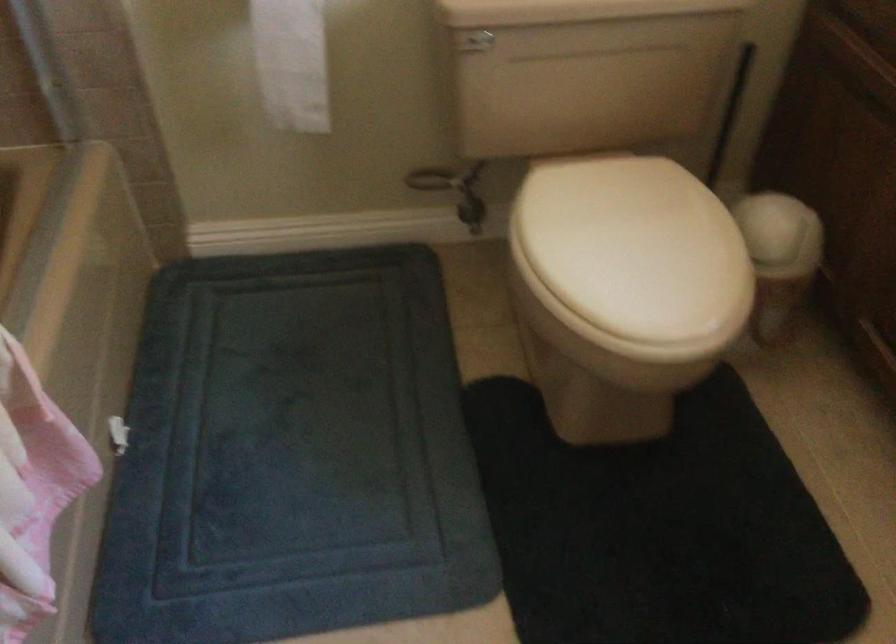
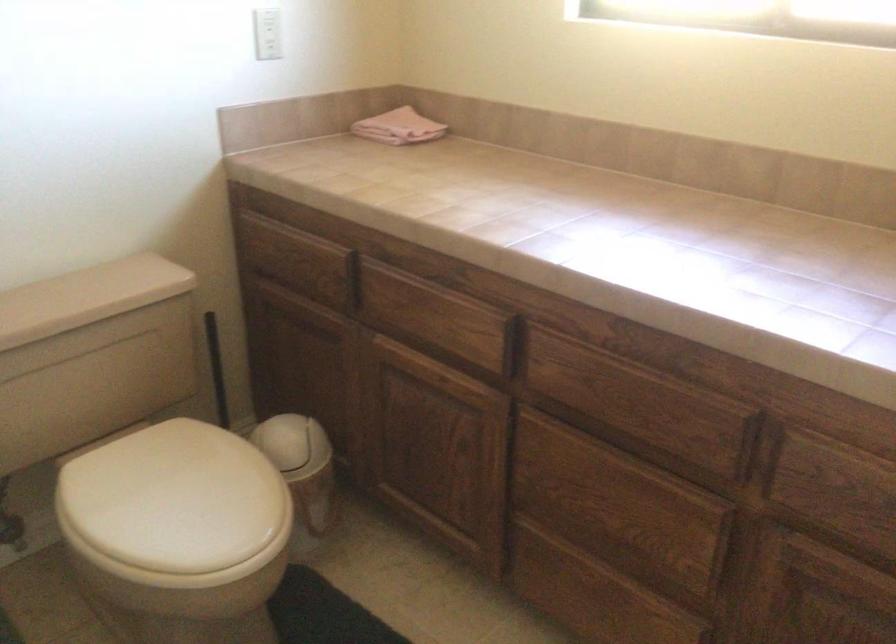
Where in the second image is the point corresponding to pixel 618 238 from the first image?

(176, 500)